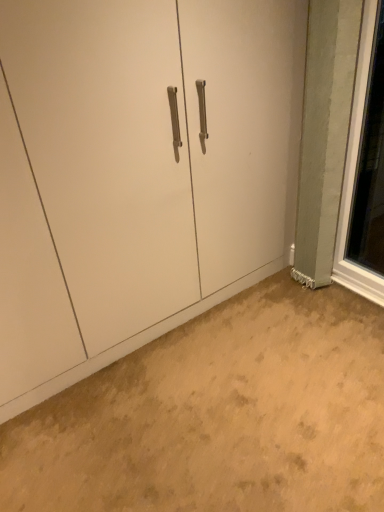
Question: Can you confirm if clear glass window at right is bigger than matte white cabinet at center?

Choices:
 (A) yes
 (B) no

Answer: (B)

Question: Is the depth of clear glass window at right less than that of matte white cabinet at center?

Choices:
 (A) no
 (B) yes

Answer: (A)

Question: Does clear glass window at right appear on the right side of matte white cabinet at center?

Choices:
 (A) no
 (B) yes

Answer: (B)

Question: From the image's perspective, is clear glass window at right beneath matte white cabinet at center?

Choices:
 (A) no
 (B) yes

Answer: (A)

Question: From a real-world perspective, is clear glass window at right below matte white cabinet at center?

Choices:
 (A) no
 (B) yes

Answer: (B)

Question: Is beige carpet at lower center bigger or smaller than matte white cabinet at center?

Choices:
 (A) big
 (B) small

Answer: (B)

Question: Considering the positions of beige carpet at lower center and matte white cabinet at center in the image, is beige carpet at lower center taller or shorter than matte white cabinet at center?

Choices:
 (A) tall
 (B) short

Answer: (B)

Question: From a real-world perspective, is beige carpet at lower center positioned above or below matte white cabinet at center?

Choices:
 (A) below
 (B) above

Answer: (A)

Question: Is beige carpet at lower center wider or thinner than matte white cabinet at center?

Choices:
 (A) wide
 (B) thin

Answer: (A)

Question: Would you say beige carpet at lower center is to the left or to the right of clear glass window at right in the picture?

Choices:
 (A) right
 (B) left

Answer: (B)

Question: Is beige carpet at lower center situated inside clear glass window at right or outside?

Choices:
 (A) inside
 (B) outside

Answer: (B)

Question: Is point (294, 463) closer or farther from the camera than point (355, 89)?

Choices:
 (A) farther
 (B) closer

Answer: (B)

Question: From a real-world perspective, is beige carpet at lower center above or below clear glass window at right?

Choices:
 (A) below
 (B) above

Answer: (A)

Question: Is point (190, 168) positioned closer to the camera than point (340, 202)?

Choices:
 (A) farther
 (B) closer

Answer: (B)

Question: Is matte white cabinet at center bigger or smaller than clear glass window at right?

Choices:
 (A) small
 (B) big

Answer: (B)